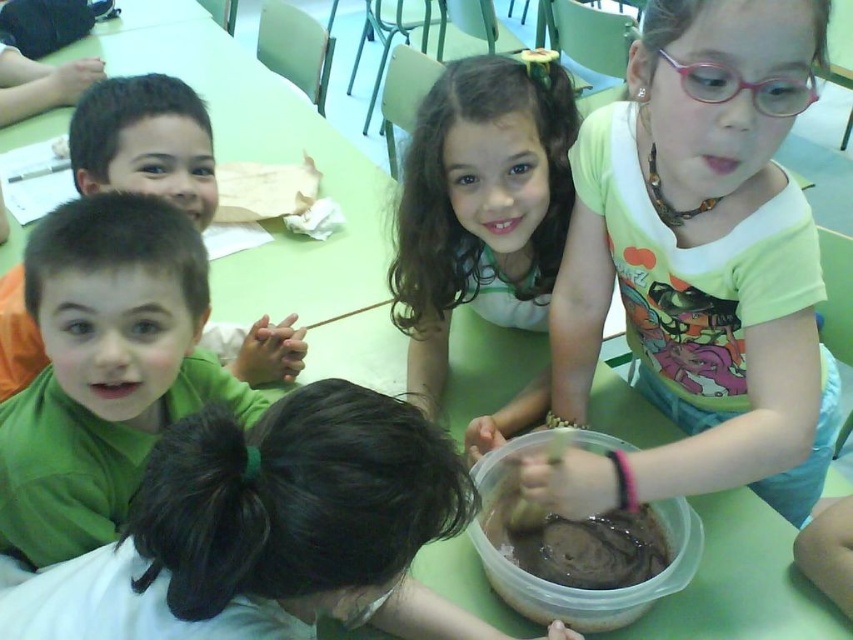
Based on the scene described, which object is bigger between the curly brown hair at upper center and the green matte shirt at left?

The curly brown hair at upper center is larger in size compared to the green matte shirt at left.